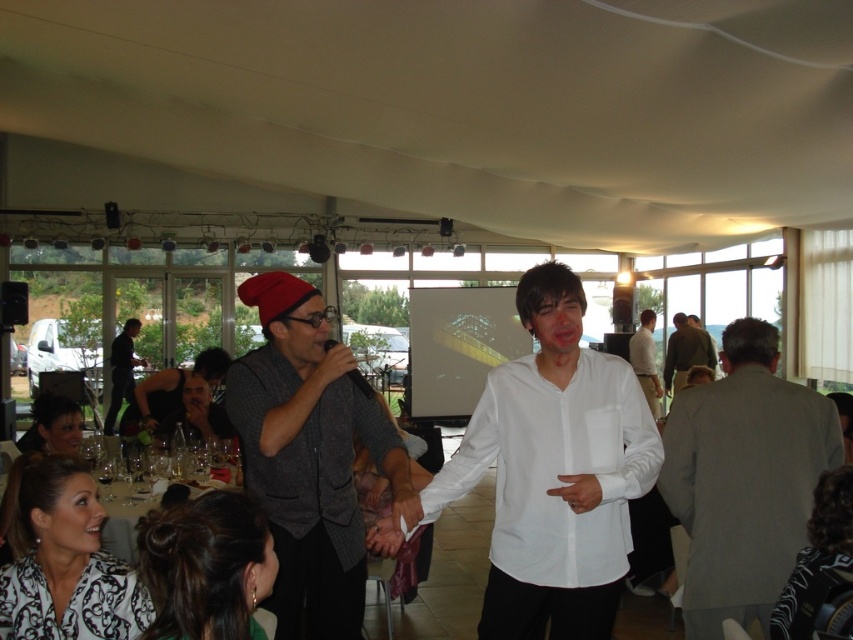
What do you see at coordinates (685, 353) in the screenshot? This screenshot has width=853, height=640. I see `green fabric shirt at center` at bounding box center [685, 353].

Where is `green fabric shirt at center`? The image size is (853, 640). green fabric shirt at center is located at coordinates (685, 353).

Who is more distant from viewer, (589, 499) or (143, 410)?

Point (143, 410)

Between white smooth shirt at center and matte gray jacket at center, which one appears on the left side from the viewer's perspective?

Answer: Positioned to the left is matte gray jacket at center.

Is point (610, 513) positioned after point (172, 380)?

No, it is not.

Where is `white smooth shirt at center`? This screenshot has height=640, width=853. white smooth shirt at center is located at coordinates (554, 472).

What do you see at coordinates (67, 563) in the screenshot?
I see `white printed blouse at lower left` at bounding box center [67, 563].

Which is behind, point (45, 579) or point (38, 448)?

Positioned behind is point (38, 448).

Is point (51, 465) farther from camera compared to point (67, 417)?

No, it is not.

I want to click on white printed blouse at lower left, so click(x=67, y=563).